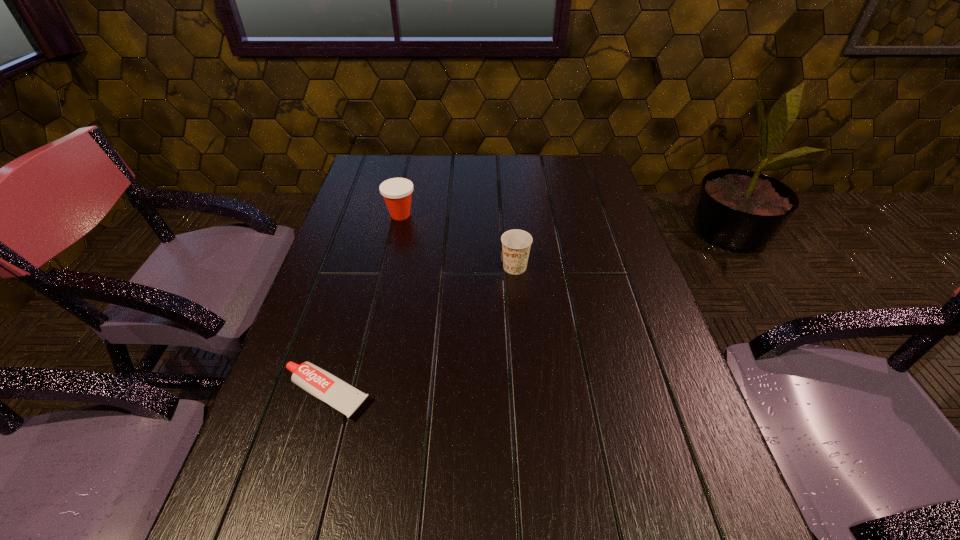
I want to click on the farthest object, so point(397,192).

The image size is (960, 540). I want to click on the farther Dixie cup, so click(x=397, y=192).

Identify the location of the rightmost object. The height and width of the screenshot is (540, 960). (516, 244).

The width and height of the screenshot is (960, 540). In order to click on the second nearest object in this screenshot , I will do `click(516, 244)`.

Identify the location of the nearest object. (321, 384).

Identify the location of the shortest object. The width and height of the screenshot is (960, 540). (321, 384).

Locate an element on the screen. The image size is (960, 540). vacant space situated on the back of the left Dixie cup is located at coordinates (406, 190).

In order to click on free location located on the front of the nearer Dixie cup in this screenshot , I will do `click(520, 326)`.

I want to click on vacant space located on the right of the nearest object, so click(483, 394).

Where is `Dixie cup that is positioned at the left edge`? The image size is (960, 540). Dixie cup that is positioned at the left edge is located at coordinates (397, 192).